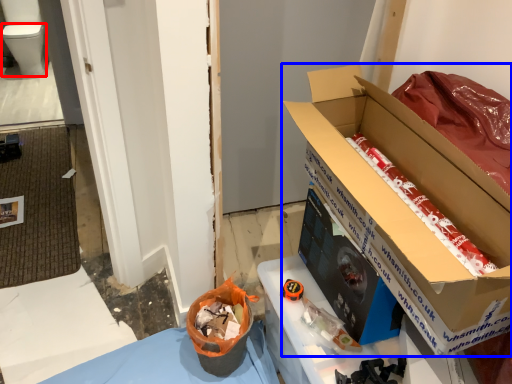
Question: Which point is closer to the camera, toilet bowl (highlighted by a red box) or box (highlighted by a blue box)?

Choices:
 (A) toilet bowl
 (B) box

Answer: (B)